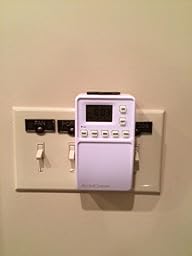
What are the coordinates of `these light switches are facing down` in the screenshot? It's located at [x=40, y=155], [x=72, y=155], [x=136, y=157].